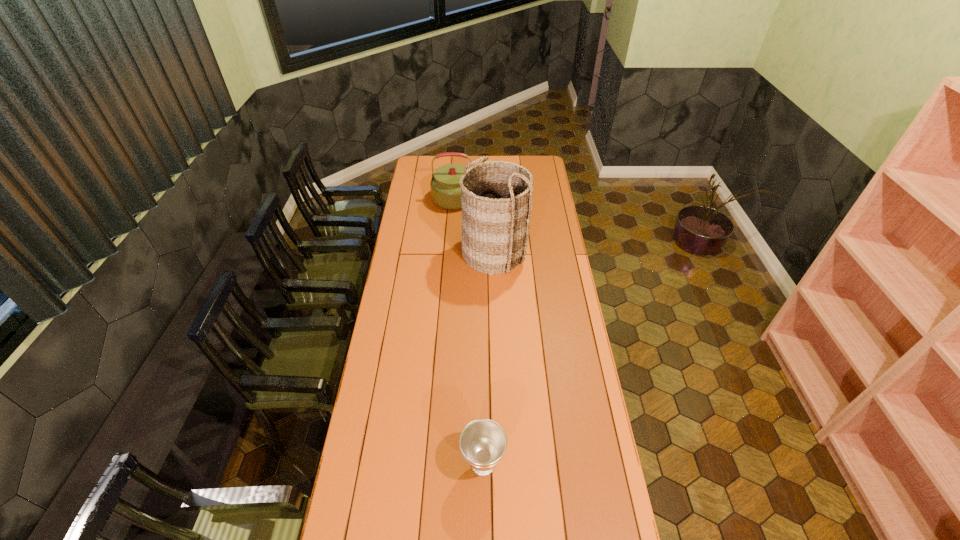
The width and height of the screenshot is (960, 540). In order to click on free space that satisfies the following two spatial constraints: 1. at the spout of the kettle; 2. on the left side of the nearest object in this screenshot , I will do `click(446, 464)`.

Where is `vacant space that satisfies the following two spatial constraints: 1. at the spout of the second nearest object; 2. on the right side of the farthest object`? Image resolution: width=960 pixels, height=540 pixels. vacant space that satisfies the following two spatial constraints: 1. at the spout of the second nearest object; 2. on the right side of the farthest object is located at coordinates (458, 252).

The image size is (960, 540). Find the location of `free location that satisfies the following two spatial constraints: 1. at the spout of the second shortest object; 2. on the left side of the basket`. free location that satisfies the following two spatial constraints: 1. at the spout of the second shortest object; 2. on the left side of the basket is located at coordinates (458, 252).

The height and width of the screenshot is (540, 960). In order to click on blank area in the image that satisfies the following two spatial constraints: 1. on the back side of the shortest object; 2. at the spout of the farthest object in this screenshot , I will do `click(482, 199)`.

The height and width of the screenshot is (540, 960). In order to click on free location that satisfies the following two spatial constraints: 1. at the spout of the chalice; 2. on the left side of the second tallest object in this screenshot , I will do [446, 464].

The width and height of the screenshot is (960, 540). I want to click on vacant space that satisfies the following two spatial constraints: 1. on the back side of the second farthest object; 2. at the spout of the farthest object, so click(x=492, y=199).